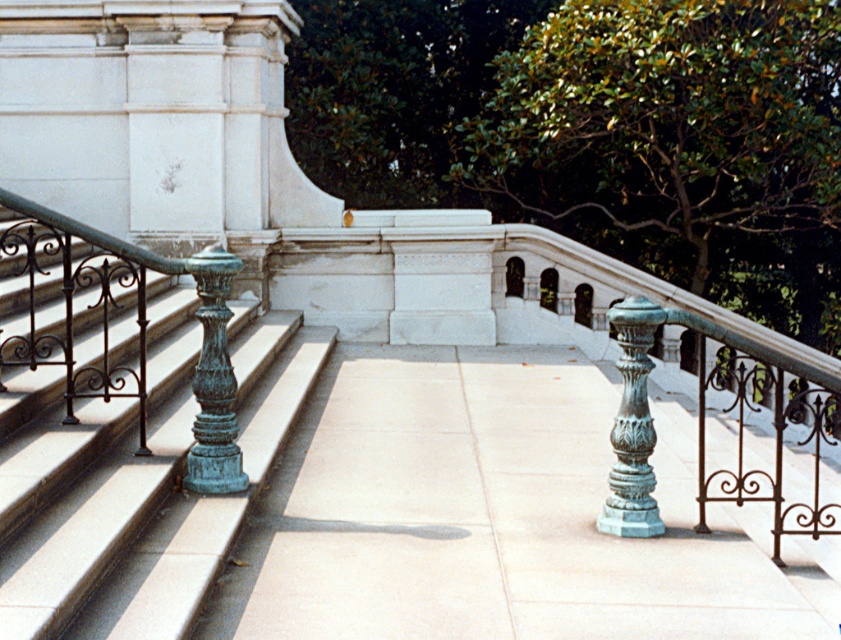
You are standing at the bottom of the light colored stone steps leading to the platform. You notice a point marked at coordinates (119, 429). What object is located at this point?

The point at (119, 429) marks the green patina metal railing at left.